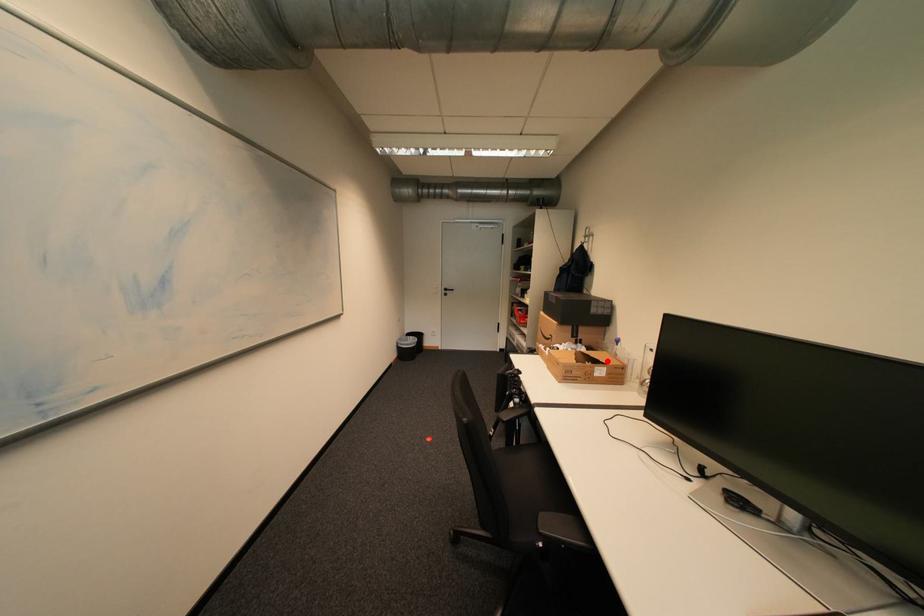
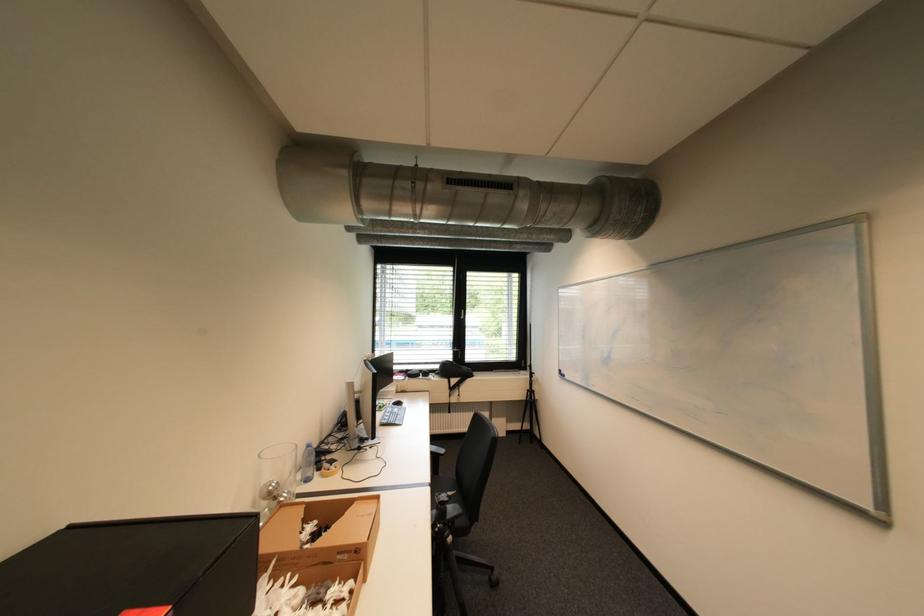
Locate, in the second image, the point that corresponds to the highlighted location in the first image.

(311, 520)